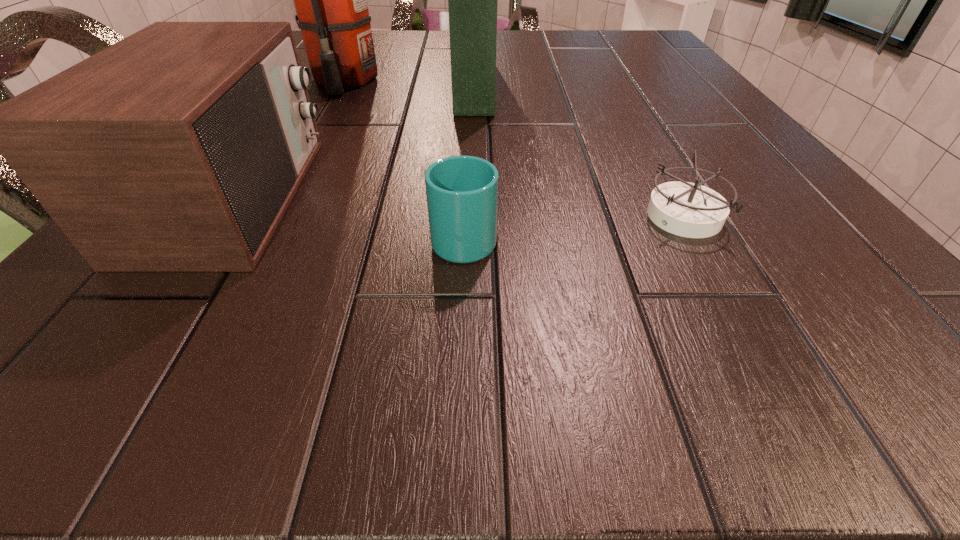
Where is `empty location between the shortest object and the tallest object`? The image size is (960, 540). empty location between the shortest object and the tallest object is located at coordinates [515, 149].

At what (x,y) coordinates should I click in order to perform the action: click on vacant area that lies between the fourth shortest object and the tallest object. Please return your answer as a coordinate pair (x, y). The image size is (960, 540). Looking at the image, I should click on (409, 83).

Find the location of a particular element. free space between the radio receiver and the second shortest object is located at coordinates (349, 218).

Locate an element on the screen. Image resolution: width=960 pixels, height=540 pixels. empty location between the compass and the fire extinguisher is located at coordinates (515, 149).

Find the location of a particular element. This screenshot has width=960, height=540. vacant point located between the radio receiver and the first-aid kit is located at coordinates (355, 141).

Locate an element on the screen. The height and width of the screenshot is (540, 960). vacant space that's between the fourth tallest object and the tallest object is located at coordinates (404, 159).

This screenshot has height=540, width=960. I want to click on free spot between the tallest object and the first-aid kit, so [x=409, y=83].

Locate an element on the screen. This screenshot has width=960, height=540. object identified as the closest to the shortest object is located at coordinates (462, 191).

Select which object appears as the closest to the radio receiver. Please provide its 2D coordinates. Your answer should be formatted as a tuple, i.e. [(x, y)], where the tuple contains the x and y coordinates of a point satisfying the conditions above.

[(330, 0)]

In order to click on free spot that satisfies the following two spatial constraints: 1. on the front-facing side of the third tallest object; 2. on the handle side of the cup in this screenshot , I will do `click(207, 238)`.